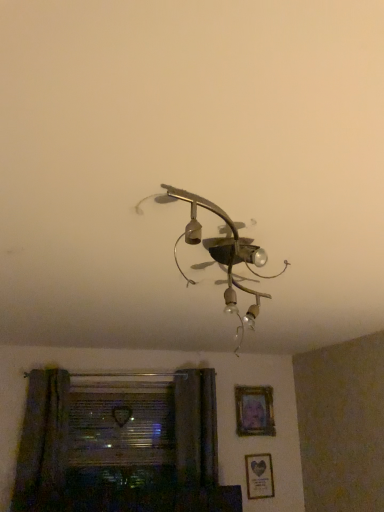
Question: Can you confirm if green fabric curtain at lower left is positioned to the left of wooden frame at upper center, the second picture frame positioned from the bottom?

Choices:
 (A) no
 (B) yes

Answer: (B)

Question: Is green fabric curtain at lower left turned away from wooden frame at upper center, positioned as the 1th picture frame in top-to-bottom order?

Choices:
 (A) no
 (B) yes

Answer: (A)

Question: Is green fabric curtain at lower left far from wooden frame at upper center, positioned as the 1th picture frame in top-to-bottom order?

Choices:
 (A) yes
 (B) no

Answer: (A)

Question: Considering the relative sizes of green fabric curtain at lower left and wooden frame at upper center, positioned as the 1th picture frame in top-to-bottom order, in the image provided, is green fabric curtain at lower left thinner than wooden frame at upper center, positioned as the 1th picture frame in top-to-bottom order,?

Choices:
 (A) no
 (B) yes

Answer: (A)

Question: Considering the relative sizes of green fabric curtain at lower left and wooden frame at upper center, the second picture frame positioned from the bottom, in the image provided, is green fabric curtain at lower left smaller than wooden frame at upper center, the second picture frame positioned from the bottom,?

Choices:
 (A) no
 (B) yes

Answer: (A)

Question: From a real-world perspective, is matte gold picture frame at lower right, the first picture frame when ordered from bottom to top, positioned above or below transparent glass window at lower left?

Choices:
 (A) below
 (B) above

Answer: (A)

Question: Does point (248, 462) appear closer or farther from the camera than point (125, 458)?

Choices:
 (A) closer
 (B) farther

Answer: (B)

Question: In the image, is matte gold picture frame at lower right, positioned as the 2th picture frame in top-to-bottom order, on the left side or the right side of transparent glass window at lower left?

Choices:
 (A) left
 (B) right

Answer: (B)

Question: Is matte gold picture frame at lower right, positioned as the 2th picture frame in top-to-bottom order, in front of or behind transparent glass window at lower left in the image?

Choices:
 (A) front
 (B) behind

Answer: (B)

Question: Considering the positions of point (41, 477) and point (264, 419), is point (41, 477) closer or farther from the camera than point (264, 419)?

Choices:
 (A) closer
 (B) farther

Answer: (A)

Question: Would you say green fabric curtain at lower left is inside or outside wooden frame at upper center, positioned as the 1th picture frame in top-to-bottom order?

Choices:
 (A) inside
 (B) outside

Answer: (B)

Question: From the image's perspective, is green fabric curtain at lower left located above or below wooden frame at upper center, the second picture frame positioned from the bottom?

Choices:
 (A) above
 (B) below

Answer: (B)

Question: Is green fabric curtain at lower left bigger or smaller than wooden frame at upper center, positioned as the 1th picture frame in top-to-bottom order?

Choices:
 (A) small
 (B) big

Answer: (B)

Question: Is transparent glass window at lower left taller or shorter than green fabric curtain at lower left?

Choices:
 (A) tall
 (B) short

Answer: (B)

Question: From a real-world perspective, is transparent glass window at lower left physically located above or below green fabric curtain at lower left?

Choices:
 (A) below
 (B) above

Answer: (B)